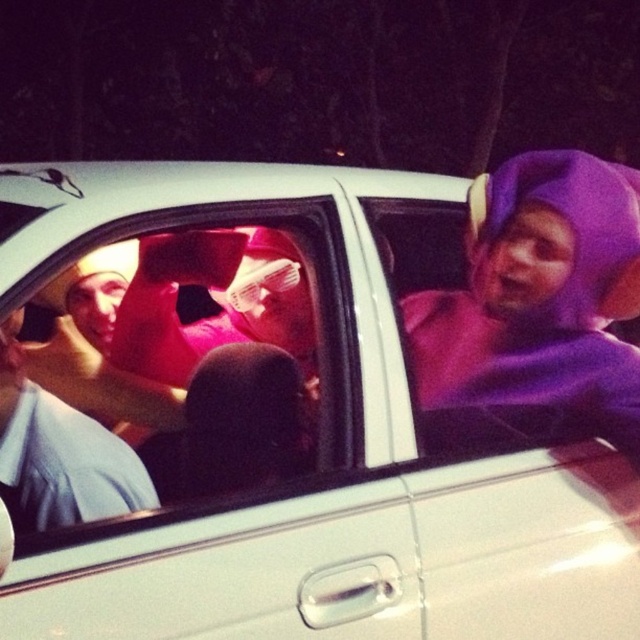
Can you confirm if transparent plastic window at center is positioned to the right of purple fabric costume at center?

Incorrect, transparent plastic window at center is not on the right side of purple fabric costume at center.

Find the location of a particular element. This screenshot has height=640, width=640. transparent plastic window at center is located at coordinates (189, 362).

In the scene shown: Which of these two, purple fabric costume at center or matte blue shirt at left, stands taller?

purple fabric costume at center is taller.

Is point (634, 172) less distant than point (10, 467)?

That is False.

Who is more forward, (460, 326) or (115, 477)?

Positioned in front is point (115, 477).

Locate an element on the screen. purple fabric costume at center is located at coordinates (540, 301).

The image size is (640, 640). Describe the element at coordinates (189, 362) in the screenshot. I see `transparent plastic window at center` at that location.

Is point (246, 384) less distant than point (48, 474)?

That is False.

Where is `transparent plastic window at center`? transparent plastic window at center is located at coordinates (189, 362).